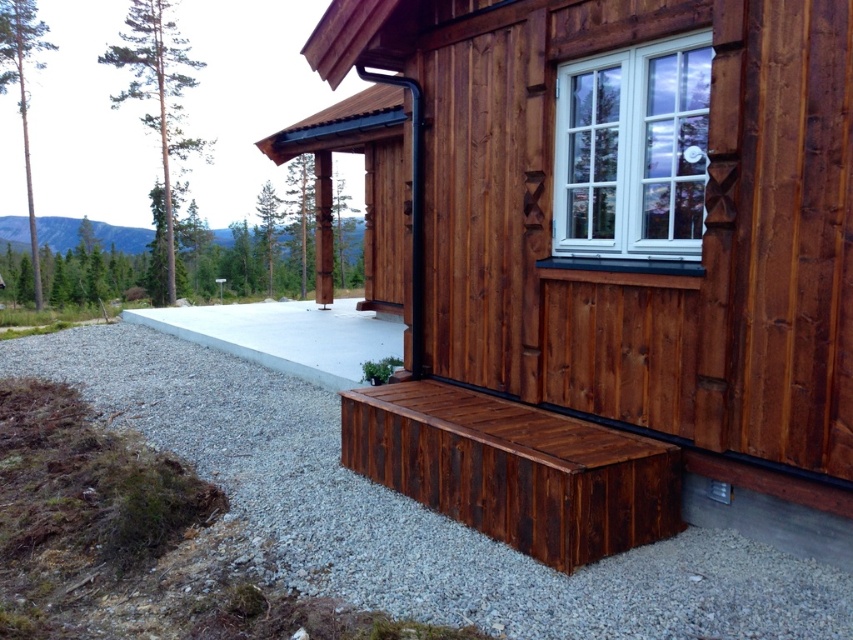
Does point (660, 128) lie behind point (508, 499)?

Yes, point (660, 128) is farther from viewer.

Can you confirm if dark brown wood bench at lower center is thinner than dark brown wood bench at lower right?

Indeed, dark brown wood bench at lower center has a lesser width compared to dark brown wood bench at lower right.

Between point (608, 476) and point (444, 496), which one is positioned in front?

Point (608, 476)

I want to click on dark brown wood bench at lower center, so click(599, 256).

Which is more to the right, dark brown wood bench at lower center or gray gravel at lower left?

gray gravel at lower left

Looking at this image, between dark brown wood bench at lower center and gray gravel at lower left, which one is positioned higher?

Positioned higher is dark brown wood bench at lower center.

This screenshot has width=853, height=640. I want to click on dark brown wood bench at lower center, so click(599, 256).

At what (x,y) coordinates should I click in order to perform the action: click on dark brown wood bench at lower center. Please return your answer as a coordinate pair (x, y). The width and height of the screenshot is (853, 640). Looking at the image, I should click on (599, 256).

Image resolution: width=853 pixels, height=640 pixels. What do you see at coordinates (415, 513) in the screenshot? I see `gray gravel at lower left` at bounding box center [415, 513].

Does gray gravel at lower left have a larger size compared to white plastic window at upper center?

Correct, gray gravel at lower left is larger in size than white plastic window at upper center.

This screenshot has width=853, height=640. What do you see at coordinates (415, 513) in the screenshot? I see `gray gravel at lower left` at bounding box center [415, 513].

Locate an element on the screen. Image resolution: width=853 pixels, height=640 pixels. gray gravel at lower left is located at coordinates (415, 513).